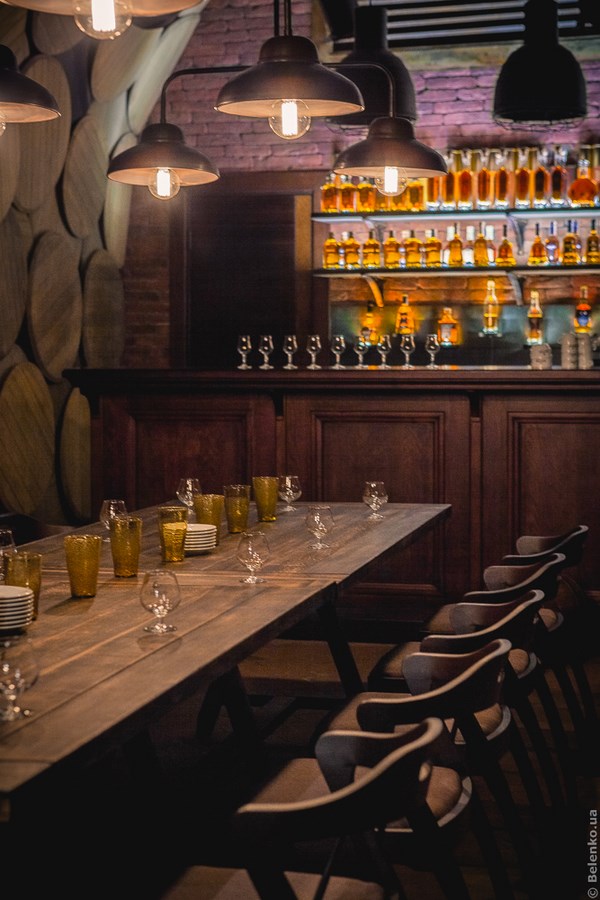
This screenshot has width=600, height=900. Find the location of `lights`. lights is located at coordinates (17, 95), (106, 24), (167, 163), (280, 87), (399, 171), (542, 92), (396, 78).